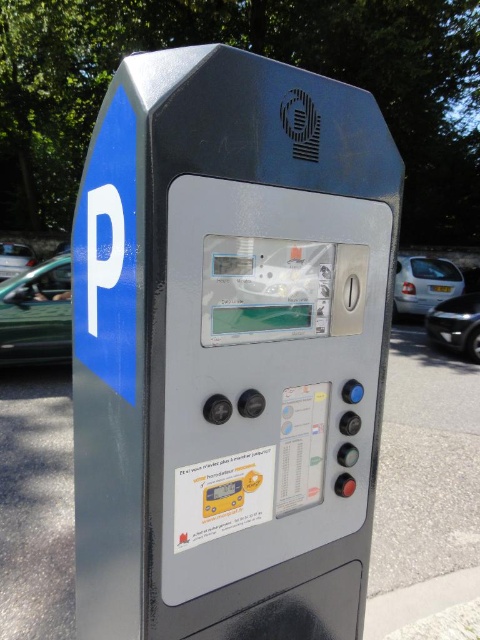
You are a delivery person standing next to the parking meter and need to place a package in the trunk of the green matte car at left. The delivery robot you are using has a maximum reach of 6 meters. Can you deliver the package without moving the robot?

The green matte car at left and camera are 6.48 meters apart. Since the delivery robot can only reach 6 meters, it cannot reach the car without moving.

You are standing in a public area with parked cars and trees around. You see a metallic parking meter at center. Where is the parking meter located relative to the point marked as point (229, 348)?

The point (229, 348) marks the location of the metallic parking meter at center, so the parking meter is exactly at that point.